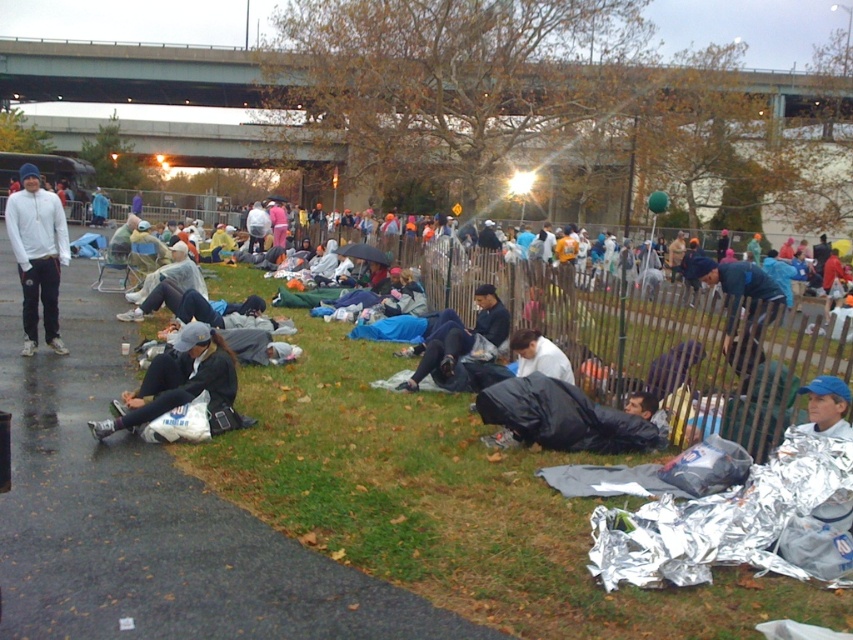
Does point (3, 624) come farther from viewer compared to point (138, 387)?

No.

Can you confirm if black asphalt at lower left is positioned above white fabric bag at lower left?

Indeed, black asphalt at lower left is positioned over white fabric bag at lower left.

The width and height of the screenshot is (853, 640). In order to click on black asphalt at lower left in this screenshot , I will do `click(149, 516)`.

This screenshot has width=853, height=640. Identify the location of black asphalt at lower left. (149, 516).

Does blue matte jacket at lower right have a lesser width compared to white matte shirt at center?

Incorrect, blue matte jacket at lower right's width is not less than white matte shirt at center's.

Is point (723, 285) less distant than point (538, 349)?

Yes, point (723, 285) is in front of point (538, 349).

This screenshot has width=853, height=640. What are the coordinates of `blue matte jacket at lower right` in the screenshot? It's located at (740, 300).

Who is positioned more to the right, green concrete bridge at upper center or blue matte jacket at lower right?

From the viewer's perspective, blue matte jacket at lower right appears more on the right side.

Can you confirm if green concrete bridge at upper center is thinner than blue matte jacket at lower right?

No, green concrete bridge at upper center is not thinner than blue matte jacket at lower right.

Between point (775, 81) and point (769, 292), which one is positioned in front?

Point (769, 292) is more forward.

The height and width of the screenshot is (640, 853). In order to click on green concrete bridge at upper center in this screenshot , I will do `click(131, 74)`.